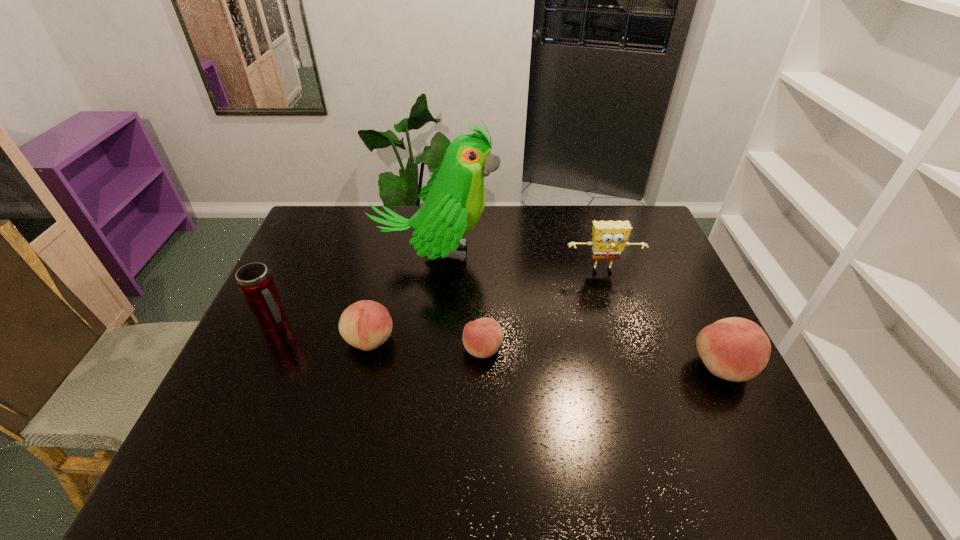
This screenshot has height=540, width=960. I want to click on vacant space located on the left of the shortest object, so click(331, 349).

You are a GUI agent. You are given a task and a screenshot of the screen. Output one action in this format:
    pyautogui.click(x=<x>, y=<y>)
    Task: Click on the vacant area situated 0.210m on the back of the fourth tallest object
    The image size is (960, 540).
    Given the screenshot: What is the action you would take?
    pyautogui.click(x=684, y=289)

Image resolution: width=960 pixels, height=540 pixels. Identify the location of free space located on the beak of the tallest object. (612, 253).

Find the location of `vacant space positioned 0.170m on the face of the second object from right to left`. vacant space positioned 0.170m on the face of the second object from right to left is located at coordinates tap(618, 321).

Identify the location of free space located on the side with the handle of the leftmost object. (426, 326).

Image resolution: width=960 pixels, height=540 pixels. In order to click on object located in the far edge section of the desktop in this screenshot , I will do `click(454, 198)`.

I want to click on object that is at the left edge, so click(255, 282).

This screenshot has width=960, height=540. I want to click on peach present at the right edge, so click(x=735, y=349).

Locate an element on the screen. Image resolution: width=960 pixels, height=540 pixels. sponge that is at the right edge is located at coordinates (609, 238).

The height and width of the screenshot is (540, 960). I want to click on vacant space at the far edge of the desktop, so click(x=413, y=206).